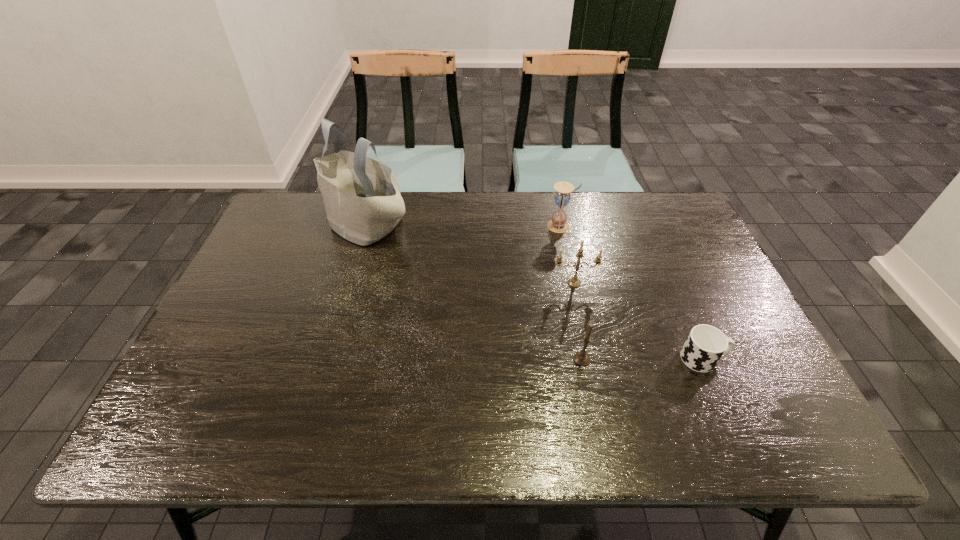
This screenshot has width=960, height=540. Find the location of `the leftmost object`. the leftmost object is located at coordinates (362, 199).

Identify the location of shopping bag. Image resolution: width=960 pixels, height=540 pixels. (362, 199).

I want to click on hourglass, so coord(558,224).

The width and height of the screenshot is (960, 540). I want to click on the third nearest object, so click(574, 282).

The image size is (960, 540). What are the coordinates of `the shorter candle` in the screenshot? It's located at (581, 358).

Where is `the nearer candle`? This screenshot has height=540, width=960. the nearer candle is located at coordinates (581, 358).

At what (x,y) coordinates should I click in order to perform the action: click on cup. Please return your answer as a coordinate pair (x, y). Looking at the image, I should click on (705, 345).

You are a GUI agent. You are given a task and a screenshot of the screen. Output one action in this format:
    pyautogui.click(x=<x>, y=<y>)
    Task: Click on the rightmost object
    The height and width of the screenshot is (540, 960).
    Given the screenshot: What is the action you would take?
    pyautogui.click(x=705, y=345)

This screenshot has width=960, height=540. I want to click on vacant area located 0.240m on the right of the shopping bag, so click(x=488, y=222).

Where is `free space located on the left of the hourglass`? This screenshot has width=960, height=540. free space located on the left of the hourglass is located at coordinates (467, 226).